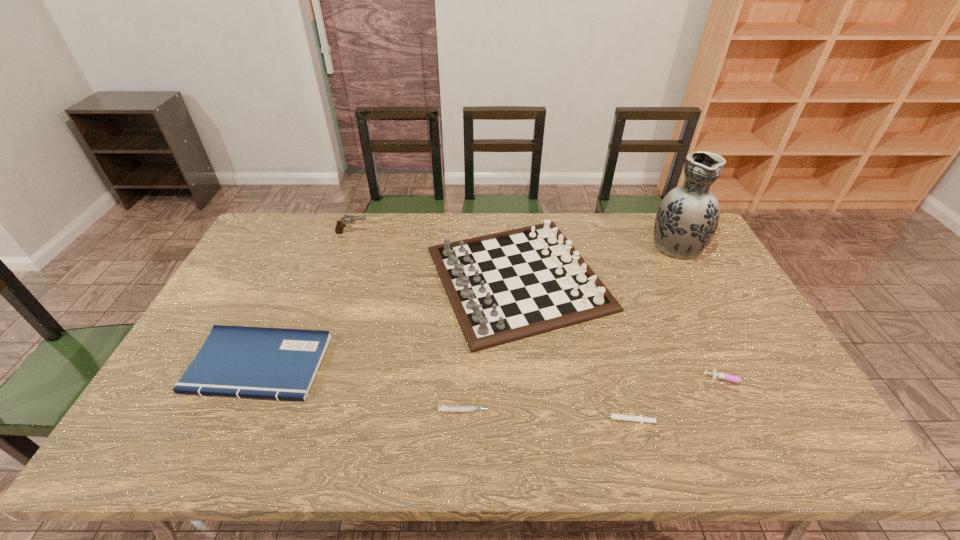
This screenshot has height=540, width=960. What are the coordinates of `the tallest object` in the screenshot? It's located at (687, 217).

Where is `the second tallest object`? the second tallest object is located at coordinates (503, 287).

Where is `pistol`? The image size is (960, 540). pistol is located at coordinates (346, 219).

Locate an element on the screen. The image size is (960, 540). the fourth shortest object is located at coordinates (235, 361).

The height and width of the screenshot is (540, 960). I want to click on the rightmost syringe, so pos(716,374).

You are a GUI agent. You are given a task and a screenshot of the screen. Output one action in this format:
    pyautogui.click(x=<x>, y=<y>)
    Task: Click on the second tallest syringe
    Image resolution: width=960 pixels, height=540 pixels.
    Given the screenshot: What is the action you would take?
    pyautogui.click(x=445, y=408)

This screenshot has height=540, width=960. Identify the location of the second farthest syringe. (445, 408).

Locate an element on the screen. the nearest object is located at coordinates (640, 419).

Locate an element on the screen. the second syringe from right to left is located at coordinates (640, 419).

What are the coordinates of `free space located 0.090m with the handle on the side of the vase` in the screenshot? It's located at (660, 213).